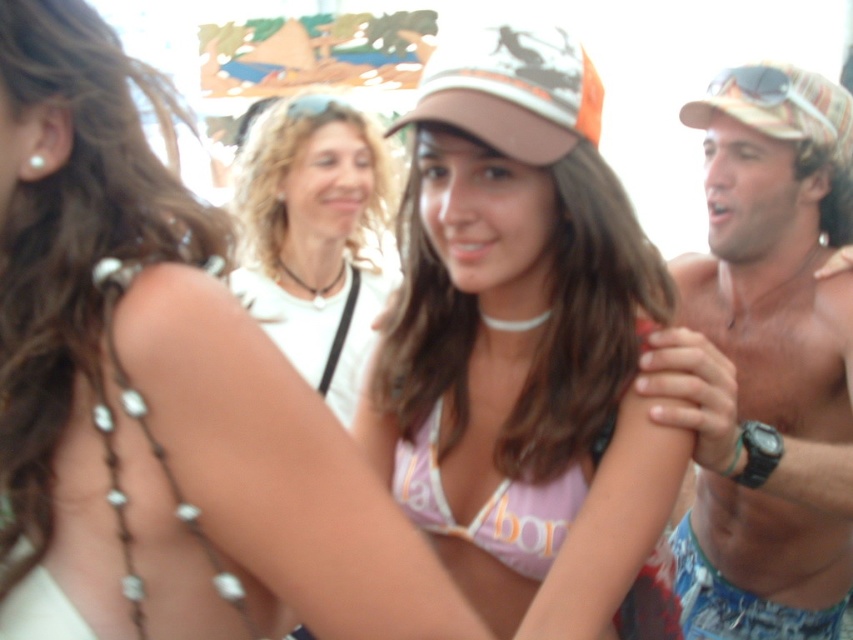
You are a photographer at the beach and want to capture both the matte pink bikini top at center and the camouflage fabric baseball cap at upper right in the same frame. Based on their positions, which object should you adjust your camera to focus on first to ensure both are in the shot?

The matte pink bikini top at center is to the left of the camouflage fabric baseball cap at upper right, so you should focus on the camouflage fabric baseball cap at upper right first to ensure both are captured in the frame.

You are a photographer at the beach event and need to capture a closeup shot of the matte pink bikini top at center and the camouflage fabric baseball cap at upper right. Since your camera has a limited focus range, which object should you focus on first to ensure both are in frame?

The matte pink bikini top at center is larger in size than the camouflage fabric baseball cap at upper right, so you should focus on the matte pink bikini top at center first to ensure both are in frame.

You are standing at the position of the central woman wearing the matte pink bikini top at center. You want to toss a beach ball to the person with curly blonde hair on your left. If the beach ball can travel 12 meters, will it reach them?

The distance between the matte pink bikini top at center and the person with curly blonde hair is 11.72 meters. Since the beach ball can travel 12 meters, it will reach them.